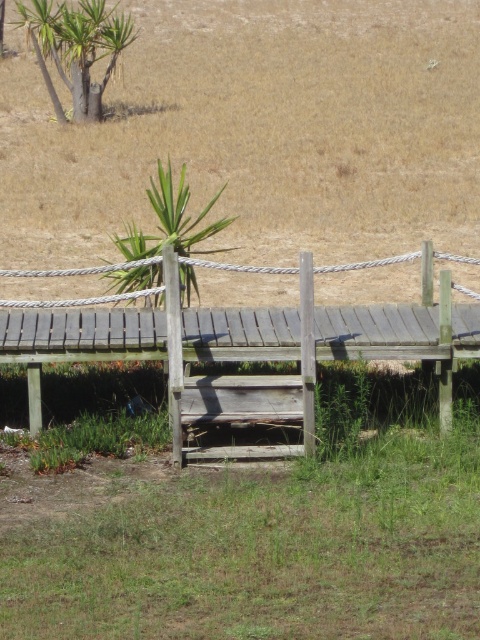
Between brown grassy field at center and green leafy plant at center, which one appears on the right side from the viewer's perspective?

From the viewer's perspective, brown grassy field at center appears more on the right side.

Based on the photo, is brown grassy field at center further to camera compared to green leafy plant at center?

Yes, brown grassy field at center is behind green leafy plant at center.

Who is more distant from viewer, (383, 250) or (168, 212)?

Positioned behind is point (383, 250).

Find the location of a particular element. The image size is (480, 640). brown grassy field at center is located at coordinates (260, 132).

Can you confirm if green grassy at lower center is taller than green leafy plant at upper left?

Incorrect, green grassy at lower center's height is not larger of green leafy plant at upper left's.

This screenshot has width=480, height=640. I want to click on green grassy at lower center, so click(262, 536).

Which is in front, point (232, 522) or point (228, 248)?

Positioned in front is point (232, 522).

Describe the element at coordinates (262, 536) in the screenshot. This screenshot has width=480, height=640. I see `green grassy at lower center` at that location.

Is point (142, 605) positioned behind point (177, 236)?

No, it is not.

Where is `green grassy at lower center`? The width and height of the screenshot is (480, 640). green grassy at lower center is located at coordinates (262, 536).